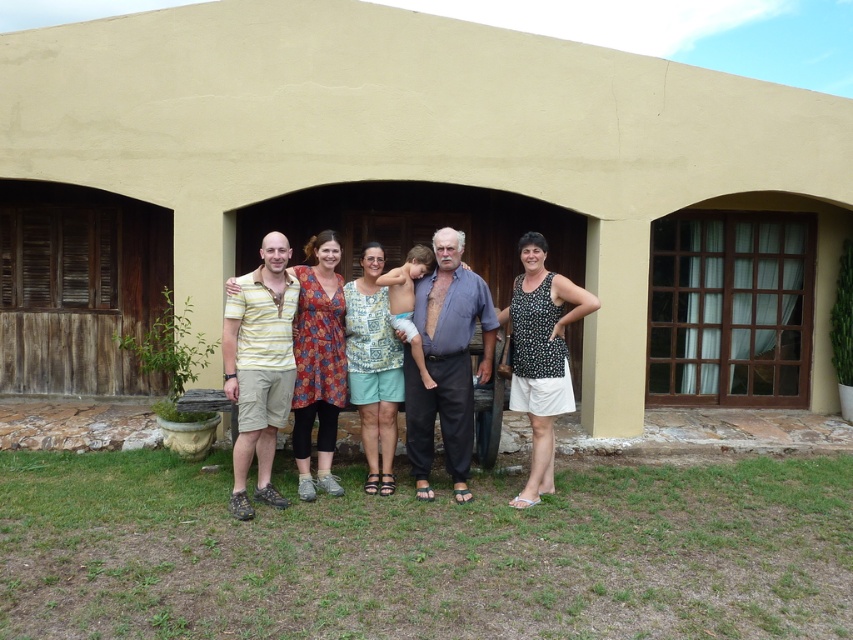
You are a photographer trying to capture a group photo of the matte yellow shirt at center and the black dotted tank top at center. The camera you are using has a minimum focusing distance of 50 centimeters. Will you be able to take a clear photo of both subjects at the same time?

The matte yellow shirt at center is 47.35 centimeters from the black dotted tank top at center. Since the camera requires a minimum focusing distance of 50 centimeters, the subjects are too close to each other for the camera to focus properly. You need to have them move further apart to ensure both are in focus.

Based on the photo, you are a photographer trying to capture a group photo of the matte yellow shirt at center and the blue cotton shirt at center. The camera you are using has a lens that can focus on objects within a 1 inch range. Can you fit both subjects within the camera focus range?

The distance between the matte yellow shirt at center and blue cotton shirt at center is 0.75 inches, which is within the camera lens focus range of 1 inch. Therefore, both subjects can be captured within the focus range.